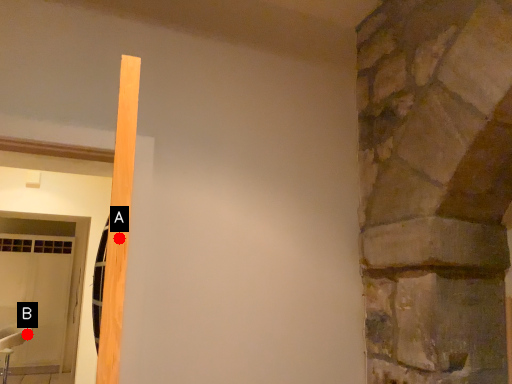
Question: Two points are circled on the image, labeled by A and B beside each circle. Which point is closer to the camera?

Choices:
 (A) A is closer
 (B) B is closer

Answer: (A)